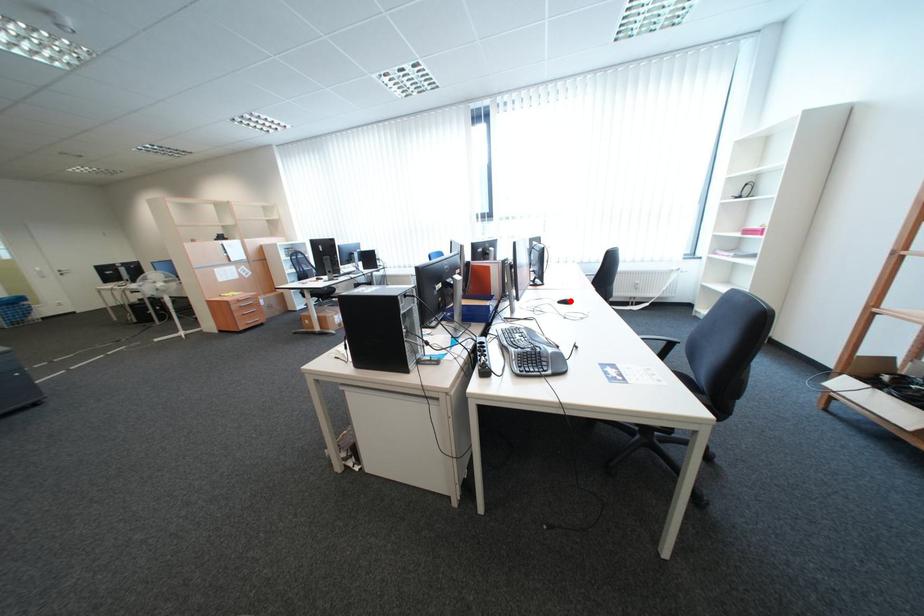
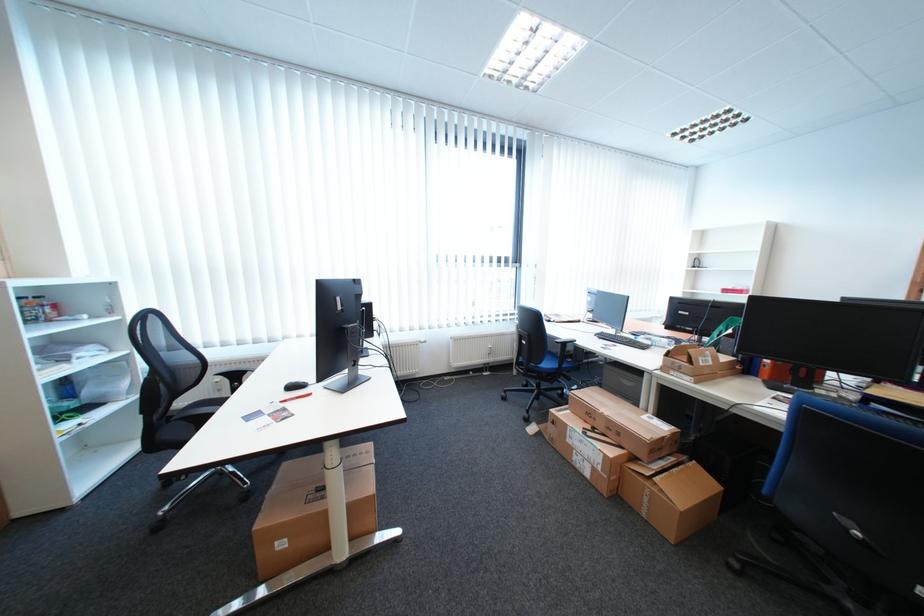
Question: I am providing you with two images of the same scene from different viewpoints. A red point is marked on the first image. Is the red point's position out of view in image 2?

Choices:
 (A) Yes
 (B) No

Answer: (A)